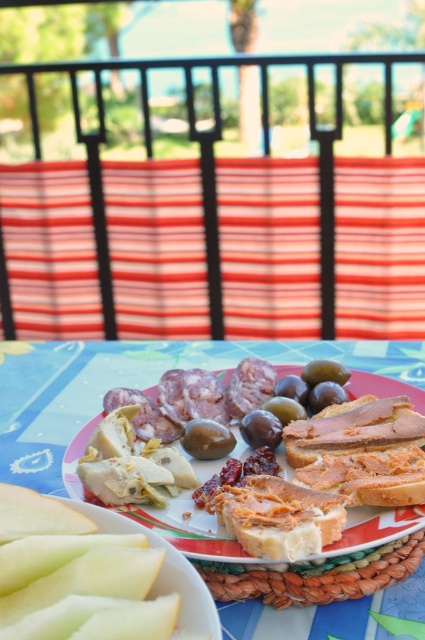
Question: Is green glossy olive at center closer to camera compared to shiny dark green olive at center?

Choices:
 (A) yes
 (B) no

Answer: (A)

Question: Which object is the closest to the shiny dark green olive at center?

Choices:
 (A) green matte apple at lower left
 (B) green glossy olive at center
 (C) matte white plate at center

Answer: (B)

Question: Does matte white plate at center appear over green glossy olive at center?

Choices:
 (A) no
 (B) yes

Answer: (A)

Question: Can you confirm if matte white plate at center is positioned above shiny dark green olive at center?

Choices:
 (A) no
 (B) yes

Answer: (A)

Question: Which point is farther from the camera taking this photo?

Choices:
 (A) (139, 520)
 (B) (200, 579)

Answer: (A)

Question: Which point is farther from the camera taking this photo?

Choices:
 (A) (260, 426)
 (B) (31, 536)
 (C) (223, 556)
 (D) (192, 456)

Answer: (D)